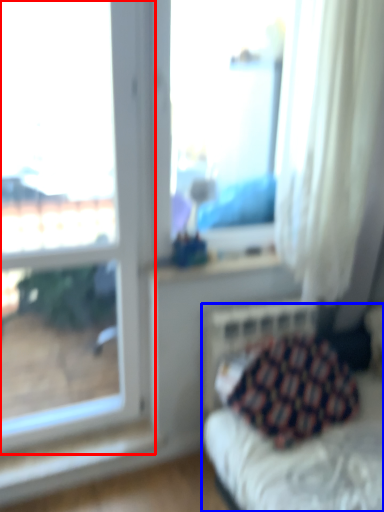
Question: Which object is further to the camera taking this photo, window (highlighted by a red box) or furniture (highlighted by a blue box)?

Choices:
 (A) window
 (B) furniture

Answer: (B)